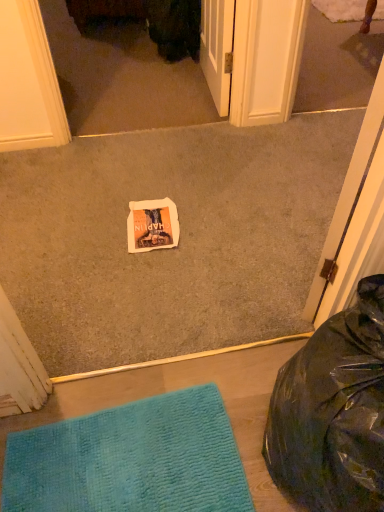
Find the location of `free spot above white paper at center (from a real-world perspective)`. free spot above white paper at center (from a real-world perspective) is located at coordinates (170, 215).